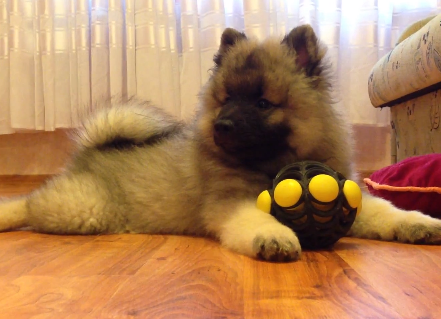
Locate an element on the screen. Image resolution: width=441 pixels, height=319 pixels. wall is located at coordinates (38, 149), (360, 150).